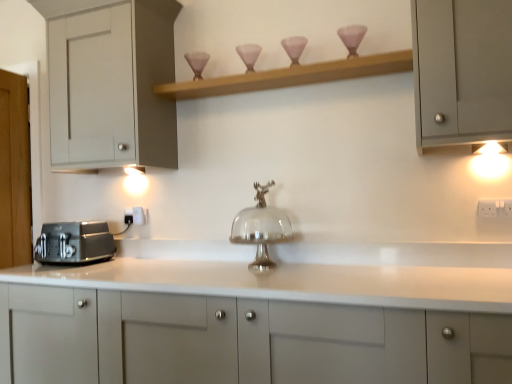
The image size is (512, 384). Describe the element at coordinates (495, 209) in the screenshot. I see `white plastic electric outlet at right, the 2th electric outlet positioned from the left` at that location.

What do you see at coordinates (241, 340) in the screenshot?
I see `white glossy cabinet at center, which ranks as the third cabinetry in top-to-bottom order` at bounding box center [241, 340].

Find the location of a particular element. This screenshot has height=384, width=512. clear glass cake stand at center is located at coordinates (260, 228).

Find the location of `white plastic electric outlet at center, marked as the first electric outlet in a left-to-right arrangement`. white plastic electric outlet at center, marked as the first electric outlet in a left-to-right arrangement is located at coordinates (134, 216).

Is warm matte light fixture at upper right wider or thinner than clear glass cake stand at center?

Considering their sizes, warm matte light fixture at upper right looks slimmer than clear glass cake stand at center.

Is warm matte light fixture at upper right further to camera compared to clear glass cake stand at center?

No, the depth of warm matte light fixture at upper right is less than that of clear glass cake stand at center.

This screenshot has height=384, width=512. What are the coordinates of `faucet that is on the left side of warm matte light fixture at upper right` in the screenshot? It's located at (260, 228).

Considering the positions of points (484, 146) and (252, 233), is point (484, 146) closer to camera compared to point (252, 233)?

That is True.

Considering the positions of points (140, 213) and (346, 44), is point (140, 213) farther from camera compared to point (346, 44)?

Yes.

Which object is more forward, white plastic electric outlet at center, marked as the first electric outlet in a left-to-right arrangement, or matte glass candle holder at upper center?

matte glass candle holder at upper center is in front.

In the scene shown: Is white plastic electric outlet at center, the first electric outlet viewed from the back, far away from matte glass candle holder at upper center?

Yes, white plastic electric outlet at center, the first electric outlet viewed from the back, and matte glass candle holder at upper center are located far from each other.

Locate an element on the screen. This screenshot has height=384, width=512. electric outlet on the left of matte glass candle holder at upper center is located at coordinates (134, 216).

Is matte glass candle holder at upper center far from white plastic electric outlet at right, the first electric outlet viewed from the front?

They are positioned close to each other.

Based on the photo, can you tell me how much matte glass candle holder at upper center and white plastic electric outlet at right, the first electric outlet viewed from the front, differ in facing direction?

They differ by 1.49 degrees in their facing directions.

Locate an element on the screen. Image resolution: width=512 pixels, height=384 pixels. candle holder located above the white plastic electric outlet at right, the first electric outlet viewed from the front (from the image's perspective) is located at coordinates (352, 37).

Does matte glass candle holder at upper center contain white plastic electric outlet at right, the 2th electric outlet positioned from the left?

No, white plastic electric outlet at right, the 2th electric outlet positioned from the left, is not inside matte glass candle holder at upper center.

Measure the distance between wooden shelf at upper center and matte gray cabinet at upper right, acting as the second cabinetry starting from the top.

The distance of wooden shelf at upper center from matte gray cabinet at upper right, acting as the second cabinetry starting from the top, is 13.91 inches.

Relative to matte gray cabinet at upper right, the second cabinetry when ordered from bottom to top, is wooden shelf at upper center in front or behind?

In the image, wooden shelf at upper center appears behind matte gray cabinet at upper right, the second cabinetry when ordered from bottom to top.

Which object is wider, wooden shelf at upper center or matte gray cabinet at upper right, the second cabinetry when ordered from bottom to top?

matte gray cabinet at upper right, the second cabinetry when ordered from bottom to top, is wider.

Considering the points (264, 89) and (490, 84), which point is behind, point (264, 89) or point (490, 84)?

The point (264, 89) is farther from the camera.

From the image's perspective, is white plastic electric outlet at center, marked as the first electric outlet in a left-to-right arrangement, positioned above or below white plastic electric outlet at right, the 2th electric outlet positioned from the left?

white plastic electric outlet at center, marked as the first electric outlet in a left-to-right arrangement, is below white plastic electric outlet at right, the 2th electric outlet positioned from the left.

Which is nearer, (x=134, y=214) or (x=500, y=210)?

The point (x=500, y=210) is closer to the camera.

Is white plastic electric outlet at center, the first electric outlet viewed from the back, far away from white plastic electric outlet at right, placed as the 2th electric outlet when sorted from back to front?

Yes.

Do you think white plastic electric outlet at center, which ranks as the 2th electric outlet in right-to-left order, is within white plastic electric outlet at right, which is the first electric outlet in right-to-left order, or outside of it?

white plastic electric outlet at center, which ranks as the 2th electric outlet in right-to-left order, is spatially situated outside white plastic electric outlet at right, which is the first electric outlet in right-to-left order.

Looking at this image, from a real-world perspective, is matte gray cabinet at upper right, the second cabinetry when ordered from bottom to top, positioned above or below white matte cabinet at left, placed as the third cabinetry when sorted from bottom to top?

In terms of real-world spatial position, matte gray cabinet at upper right, the second cabinetry when ordered from bottom to top, is below white matte cabinet at left, placed as the third cabinetry when sorted from bottom to top.

Is matte gray cabinet at upper right, acting as the second cabinetry starting from the top, taller or shorter than white matte cabinet at left, which ranks as the 1th cabinetry in top-to-bottom order?

Clearly, matte gray cabinet at upper right, acting as the second cabinetry starting from the top, is shorter compared to white matte cabinet at left, which ranks as the 1th cabinetry in top-to-bottom order.

Based on the photo, from the image's perspective, relative to white matte cabinet at left, placed as the third cabinetry when sorted from bottom to top, is matte gray cabinet at upper right, the second cabinetry when ordered from bottom to top, above or below?

From the image's perspective, matte gray cabinet at upper right, the second cabinetry when ordered from bottom to top, appears below white matte cabinet at left, placed as the third cabinetry when sorted from bottom to top.

Consider the image. Is the depth of white plastic electric outlet at center, which ranks as the 2th electric outlet in right-to-left order, greater than that of white glossy cabinet at center, which ranks as the third cabinetry in top-to-bottom order?

Yes, it is.

Considering the points (129, 210) and (362, 311), which point is in front, point (129, 210) or point (362, 311)?

The point (362, 311) is closer.

Would you say white plastic electric outlet at center, the first electric outlet viewed from the back, contains white glossy cabinet at center, which ranks as the third cabinetry in top-to-bottom order?

No, white plastic electric outlet at center, the first electric outlet viewed from the back, does not contain white glossy cabinet at center, which ranks as the third cabinetry in top-to-bottom order.

Considering the relative positions of white plastic electric outlet at center, which is the second electric outlet in front-to-back order, and white glossy cabinet at center, the first cabinetry when ordered from bottom to top, in the image provided, is white plastic electric outlet at center, which is the second electric outlet in front-to-back order, to the left of white glossy cabinet at center, the first cabinetry when ordered from bottom to top, from the viewer's perspective?

Yes, white plastic electric outlet at center, which is the second electric outlet in front-to-back order, is to the left of white glossy cabinet at center, the first cabinetry when ordered from bottom to top.

The image size is (512, 384). Find the location of `light fixture above the clear glass cake stand at center (from a real-world perspective)`. light fixture above the clear glass cake stand at center (from a real-world perspective) is located at coordinates (490, 160).

Find the location of a particular element. The width and height of the screenshot is (512, 384). electric outlet behind the matte glass candle holder at upper center is located at coordinates (134, 216).

Considering their positions, is matte gray cabinet at upper right, acting as the second cabinetry starting from the top, positioned further to white glossy cabinet at center, the first cabinetry when ordered from bottom to top, than clear glass cake stand at center?

The object further to white glossy cabinet at center, the first cabinetry when ordered from bottom to top, is matte gray cabinet at upper right, acting as the second cabinetry starting from the top.

From the picture: Estimate the real-world distances between objects in this image. Which object is further from matte glass candle holder at upper center, wooden shelf at upper center or warm matte light fixture at upper right?

warm matte light fixture at upper right is positioned further to the anchor matte glass candle holder at upper center.

Based on the photo, when comparing their distances from matte black toaster at left, does matte glass candle holder at upper center or white plastic electric outlet at right, the first electric outlet viewed from the front, seem further?

white plastic electric outlet at right, the first electric outlet viewed from the front, is further to matte black toaster at left.

Estimate the real-world distances between objects in this image. Which object is closer to wooden shelf at upper center, warm matte light fixture at upper right or white matte cabinet at left, which ranks as the 1th cabinetry in top-to-bottom order?

white matte cabinet at left, which ranks as the 1th cabinetry in top-to-bottom order, is positioned closer to the anchor wooden shelf at upper center.

From the image, which object appears to be farther from matte gray cabinet at upper right, the second cabinetry when ordered from bottom to top, warm matte light fixture at upper right or white plastic electric outlet at right, placed as the 2th electric outlet when sorted from back to front?

Based on the image, white plastic electric outlet at right, placed as the 2th electric outlet when sorted from back to front, appears to be further to matte gray cabinet at upper right, the second cabinetry when ordered from bottom to top.

In the scene shown: Considering their positions, is wooden shelf at upper center positioned closer to warm matte light fixture at upper right than white plastic electric outlet at right, the 2th electric outlet positioned from the left?

Among the two, white plastic electric outlet at right, the 2th electric outlet positioned from the left, is located nearer to warm matte light fixture at upper right.

Considering their positions, is white plastic electric outlet at center, which ranks as the 2th electric outlet in right-to-left order, positioned closer to matte gray cabinet at upper right, acting as the second cabinetry starting from the top, than clear glass cake stand at center?

clear glass cake stand at center lies closer to matte gray cabinet at upper right, acting as the second cabinetry starting from the top, than the other object.

Looking at the image, which one is located closer to white glossy cabinet at center, which ranks as the third cabinetry in top-to-bottom order, wooden shelf at upper center or matte gray cabinet at upper right, the second cabinetry when ordered from bottom to top?

The object closer to white glossy cabinet at center, which ranks as the third cabinetry in top-to-bottom order, is matte gray cabinet at upper right, the second cabinetry when ordered from bottom to top.

Find the location of a particular element. Image resolution: width=512 pixels, height=384 pixels. candle holder between white glossy cabinet at center, the first cabinetry when ordered from bottom to top, and matte black toaster at left from front to back is located at coordinates (352, 37).

Where is `faucet between matte black toaster at left and matte gray cabinet at upper right, the second cabinetry when ordered from bottom to top, from left to right`? This screenshot has width=512, height=384. faucet between matte black toaster at left and matte gray cabinet at upper right, the second cabinetry when ordered from bottom to top, from left to right is located at coordinates (260, 228).

Locate an element on the screen. The height and width of the screenshot is (384, 512). faucet located between white plastic electric outlet at center, marked as the first electric outlet in a left-to-right arrangement, and warm matte light fixture at upper right in the left-right direction is located at coordinates (260, 228).

You are a GUI agent. You are given a task and a screenshot of the screen. Output one action in this format:
    pyautogui.click(x=<x>, y=<y>)
    Task: Click on the candle holder located between white plastic electric outlet at center, which ranks as the 2th electric outlet in right-to-left order, and warm matte light fixture at upper right in the left-right direction
    Image resolution: width=512 pixels, height=384 pixels.
    Given the screenshot: What is the action you would take?
    pyautogui.click(x=352, y=37)